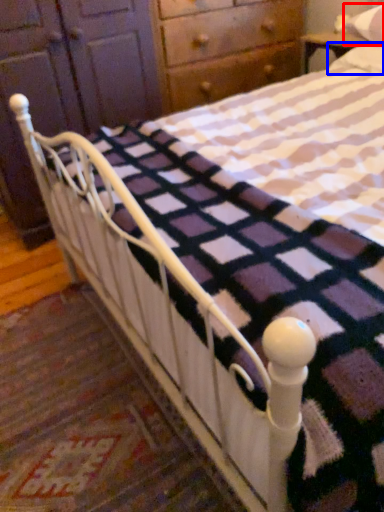
Question: Which point is further to the camera, pillow (highlighted by a red box) or pillow (highlighted by a blue box)?

Choices:
 (A) pillow
 (B) pillow

Answer: (A)